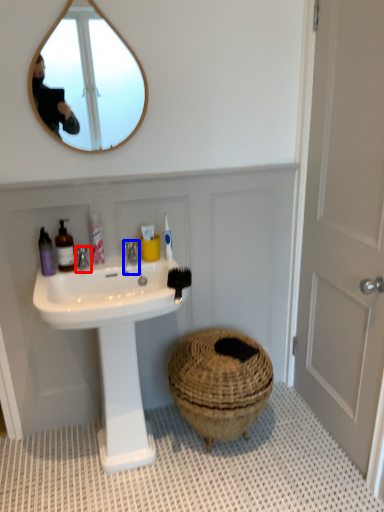
Question: Which object appears closest to the camera in this image, tap (highlighted by a red box) or faucet (highlighted by a blue box)?

Choices:
 (A) tap
 (B) faucet

Answer: (A)